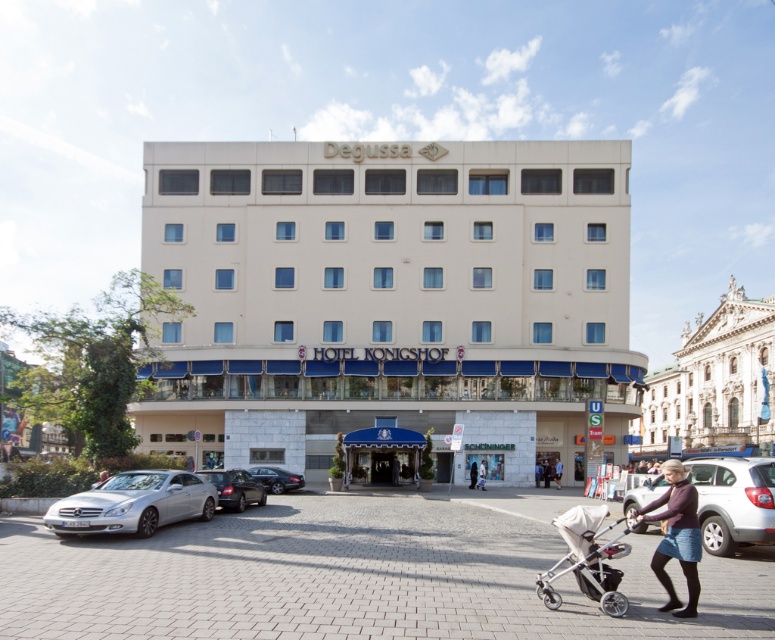
Question: Among these objects, which one is farthest from the camera?

Choices:
 (A) white marble building at upper right
 (B) silver metallic car at lower right
 (C) shiny silver sedan at lower left

Answer: (A)

Question: Which object appears farthest from the camera in this image?

Choices:
 (A) matte purple sweater at lower right
 (B) silver metallic car at lower left

Answer: (B)

Question: Is beige stone building at center positioned at the back of silver metallic car at lower right?

Choices:
 (A) no
 (B) yes

Answer: (B)

Question: Which point appears closest to the camera in this image?

Choices:
 (A) [729, 497]
 (B) [50, 509]
 (C) [221, 484]

Answer: (A)

Question: Is silver metallic stroller at lower right bigger than dark gray sweater at center?

Choices:
 (A) no
 (B) yes

Answer: (B)

Question: Can you confirm if matte purple sweater at lower right is positioned to the right of dark blue jeans at center?

Choices:
 (A) yes
 (B) no

Answer: (A)